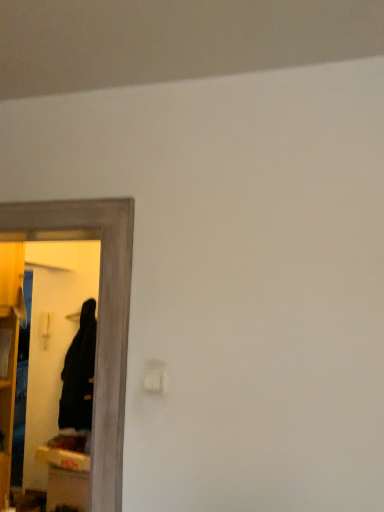
What are the coordinates of `black matte mirror at left` in the screenshot? It's located at (98, 315).

Describe the element at coordinates (98, 315) in the screenshot. I see `black matte mirror at left` at that location.

The height and width of the screenshot is (512, 384). Find the location of `black matte robe at left`. black matte robe at left is located at coordinates (79, 374).

What do you see at coordinates (79, 374) in the screenshot? I see `black matte robe at left` at bounding box center [79, 374].

I want to click on black matte mirror at left, so click(98, 315).

Can you confirm if black matte mirror at left is positioned to the right of black matte robe at left?

Correct, you'll find black matte mirror at left to the right of black matte robe at left.

Is the depth of black matte mirror at left greater than that of black matte robe at left?

No, black matte mirror at left is closer to the viewer.

Does point (104, 476) come closer to viewer compared to point (79, 374)?

Yes, point (104, 476) is closer to viewer.

From the image's perspective, is black matte mirror at left located above or below black matte robe at left?

black matte mirror at left is situated higher than black matte robe at left in the image.

Consider the image. From a real-world perspective, does black matte mirror at left sit lower than black matte robe at left?

No, from a real-world perspective, black matte mirror at left is not below black matte robe at left.

Considering the relative sizes of black matte mirror at left and black matte robe at left in the image provided, is black matte mirror at left wider than black matte robe at left?

Incorrect, the width of black matte mirror at left does not surpass that of black matte robe at left.

Is black matte mirror at left taller or shorter than black matte robe at left?

Clearly, black matte mirror at left is taller compared to black matte robe at left.

Considering the sizes of black matte mirror at left and black matte robe at left in the image, is black matte mirror at left bigger or smaller than black matte robe at left?

Considering their sizes, black matte mirror at left takes up less space than black matte robe at left.

Does black matte mirror at left contain black matte robe at left?

Definitely not — black matte robe at left is not inside black matte mirror at left.

Can you see black matte mirror at left touching black matte robe at left?

No.

Does black matte mirror at left turn towards black matte robe at left?

No, black matte mirror at left is not facing towards black matte robe at left.

Based on the photo, how different are the orientations of black matte mirror at left and black matte robe at left in degrees?

black matte mirror at left and black matte robe at left are facing 1.16 degrees away from each other.

The image size is (384, 512). I want to click on robe below the black matte mirror at left (from a real-world perspective), so click(x=79, y=374).

Does black matte robe at left appear on the right side of black matte mirror at left?

No.

Between black matte robe at left and black matte mirror at left, which one is positioned in front?

black matte mirror at left.

Considering the points (88, 399) and (128, 285), which point is behind, point (88, 399) or point (128, 285)?

The point (88, 399) is behind.

From the image's perspective, is black matte robe at left below black matte mirror at left?

Yes.

From a real-world perspective, is black matte robe at left located beneath black matte mirror at left?

Yes, from a real-world perspective, black matte robe at left is below black matte mirror at left.

Based on the photo, can you confirm if black matte robe at left is thinner than black matte mirror at left?

In fact, black matte robe at left might be wider than black matte mirror at left.

In the scene shown: Considering the sizes of objects black matte robe at left and black matte mirror at left in the image provided, who is taller, black matte robe at left or black matte mirror at left?

With more height is black matte mirror at left.

Based on their sizes in the image, would you say black matte robe at left is bigger or smaller than black matte mirror at left?

Considering their sizes, black matte robe at left takes up more space than black matte mirror at left.

Is black matte robe at left located outside black matte mirror at left?

Yes, black matte robe at left is outside of black matte mirror at left.

Are black matte robe at left and black matte mirror at left beside each other?

No, black matte robe at left is not making contact with black matte mirror at left.

Could you tell me if black matte robe at left is turned towards black matte mirror at left?

No, black matte robe at left is not oriented towards black matte mirror at left.

How far apart are black matte robe at left and black matte mirror at left?

They are 6.98 feet apart.

You are a GUI agent. You are given a task and a screenshot of the screen. Output one action in this format:
    pyautogui.click(x=<x>, y=<y>)
    Task: Click on the mirror above the black matte robe at left (from a real-world perspective)
    The height and width of the screenshot is (512, 384).
    Given the screenshot: What is the action you would take?
    pyautogui.click(x=98, y=315)

The image size is (384, 512). In order to click on robe below the black matte mirror at left (from the image's perspective) in this screenshot , I will do `click(79, 374)`.

Find the location of a particular element. This screenshot has width=384, height=512. robe behind the black matte mirror at left is located at coordinates (79, 374).